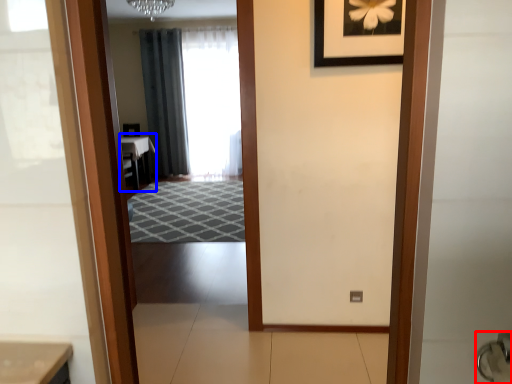
Question: Which point is closer to the camera, door handle (highlighted by a red box) or table (highlighted by a blue box)?

Choices:
 (A) door handle
 (B) table

Answer: (A)